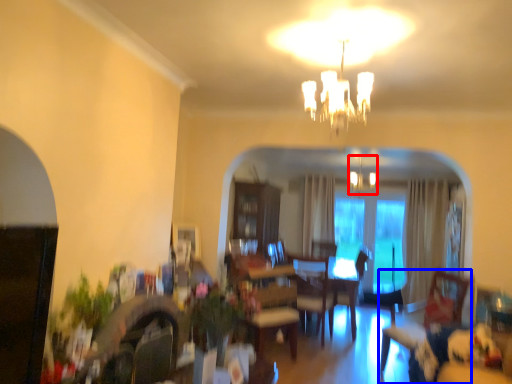
Question: Which object appears farthest to the camera in this image, fixture (highlighted by a red box) or swivel chair (highlighted by a blue box)?

Choices:
 (A) fixture
 (B) swivel chair

Answer: (A)